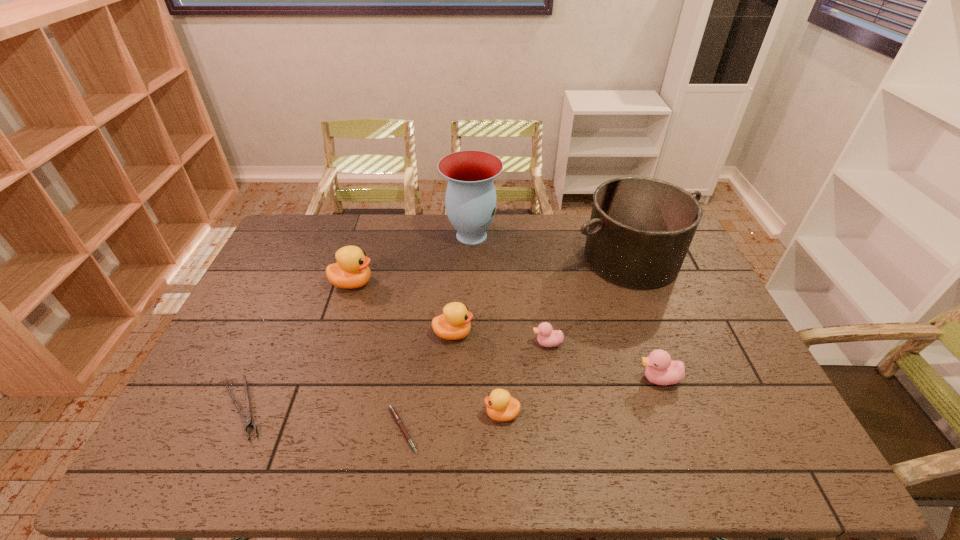
The image size is (960, 540). Find the location of `vacant space at the far edge of the desktop`. vacant space at the far edge of the desktop is located at coordinates (528, 224).

The image size is (960, 540). I want to click on vacant space at the near edge of the desktop, so click(467, 442).

What are the coordinates of `free location at the left edge of the desktop` in the screenshot? It's located at (287, 319).

At what (x,y) coordinates should I click in order to perform the action: click on blank space at the right edge of the desktop. Please return your answer as a coordinate pair (x, y). This screenshot has width=960, height=540. Looking at the image, I should click on (751, 363).

You are a GUI agent. You are given a task and a screenshot of the screen. Output one action in this format:
    pyautogui.click(x=<x>, y=<y>)
    Task: Click on the blank area at the far left corner
    
    Given the screenshot: What is the action you would take?
    pyautogui.click(x=319, y=229)

Where is `free space at the near right corner of the desktop`? This screenshot has width=960, height=540. free space at the near right corner of the desktop is located at coordinates (734, 448).

Locate an element on the screen. The width and height of the screenshot is (960, 540). vacant space in between the third tallest object and the vase is located at coordinates (412, 259).

At what (x,y) coordinates should I click in order to perform the action: click on free space between the second nearest yellow duckling and the pan. Please return your answer as a coordinate pair (x, y). Looking at the image, I should click on (541, 296).

You are a GUI agent. You are given a task and a screenshot of the screen. Output one action in this format:
    pyautogui.click(x=<x>, y=<y>)
    Task: Click on the free spot between the pan and the farthest yellow duckling
    Image resolution: width=960 pixels, height=540 pixels.
    Given the screenshot: What is the action you would take?
    pyautogui.click(x=492, y=271)

Locate an element on the screen. free spot between the leftmost yellow duckling and the pan is located at coordinates (492, 271).